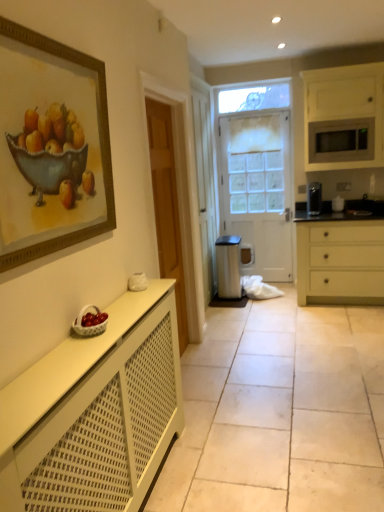
Question: Is point (1, 505) closer or farther from the camera than point (332, 138)?

Choices:
 (A) farther
 (B) closer

Answer: (B)

Question: From a real-world perspective, relative to matte silver microwave at upper right, is white matte radiator at lower left, which is the 2th cabinetry in back-to-front order, vertically above or below?

Choices:
 (A) below
 (B) above

Answer: (A)

Question: Considering the real-world distances, which object is farthest from the white matte radiator at lower left, acting as the 1th cabinetry starting from the bottom?

Choices:
 (A) white matte microwave at upper right, the second cabinetry when ordered from left to right
 (B) black matte sink at right
 (C) gold-framed print at upper left
 (D) satin silver trash can at center
 (E) matte cream drawer at right

Answer: (B)

Question: Which object is positioned farthest from the satin silver trash can at center?

Choices:
 (A) black matte sink at right
 (B) gold-framed print at upper left
 (C) white matte microwave at upper right, the second cabinetry when ordered from left to right
 (D) matte cream drawer at right
 (E) white frosted glass door at center

Answer: (B)